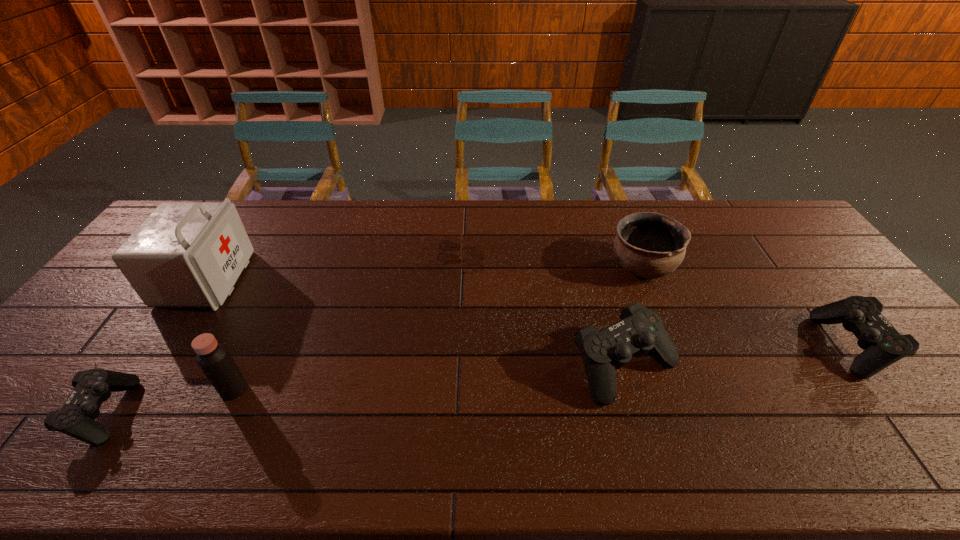
At what (x,y) coordinates should I click in order to perform the action: click on sunglasses. Please return your answer as a coordinate pair (x, y). Looking at the image, I should click on (460, 258).

Identify the location of the shortest object. The height and width of the screenshot is (540, 960). (460, 258).

Identify the location of vacant space positioned on the right of the shortest control. Image resolution: width=960 pixels, height=540 pixels. (259, 413).

Where is `vacant area situated on the right of the fourth tallest object`? The width and height of the screenshot is (960, 540). vacant area situated on the right of the fourth tallest object is located at coordinates (768, 366).

Locate an element on the screen. vacant region located on the back of the second tallest control is located at coordinates (781, 254).

Locate an element on the screen. vacant space located on the front-facing side of the tallest object is located at coordinates (290, 279).

Find the location of `vacant area situated on the back of the pottery`. vacant area situated on the back of the pottery is located at coordinates (620, 212).

At what (x,y) coordinates should I click in order to perform the action: click on blank space located 0.180m on the back of the vinegar. Please return your answer as a coordinate pair (x, y). Image resolution: width=960 pixels, height=540 pixels. Looking at the image, I should click on (265, 323).

The width and height of the screenshot is (960, 540). In order to click on vacant space located on the front-facing side of the shortest object in this screenshot , I will do [536, 254].

The width and height of the screenshot is (960, 540). I want to click on vinegar that is at the near edge, so click(x=213, y=358).